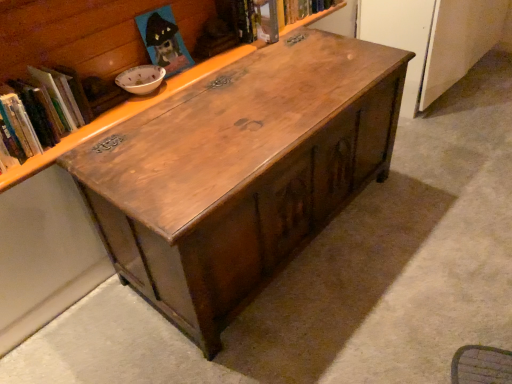
Question: From a real-world perspective, is hardcover book at upper center, acting as the second book starting from the left, positioned above or below wooden chest at center?

Choices:
 (A) above
 (B) below

Answer: (A)

Question: Looking at the image, does hardcover book at upper center, positioned as the 1th book in top-to-bottom order, seem bigger or smaller compared to wooden chest at center?

Choices:
 (A) big
 (B) small

Answer: (B)

Question: Which of these objects is positioned farthest from the wooden chest at center?

Choices:
 (A) wooden chest at center
 (B) hardcover book at upper center, which is counted as the first book, starting from the right
 (C) hardcover book at upper left, which ranks as the second book in top-to-bottom order

Answer: (A)

Question: Considering the real-world distances, which object is farthest from the wooden chest at center?

Choices:
 (A) wooden chest at center
 (B) hardcover book at upper left, marked as the second book in a right-to-left arrangement
 (C) hardcover book at upper center, positioned as the 1th book in top-to-bottom order

Answer: (C)